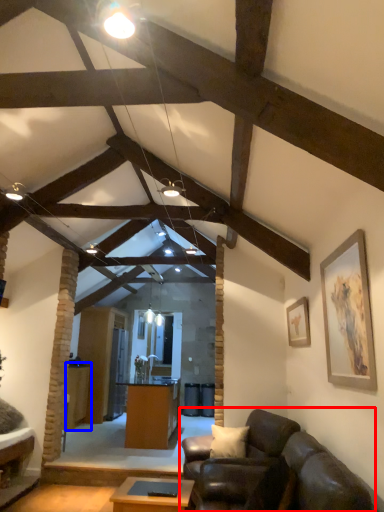
Question: Which object appears closest to the camera in this image, studio couch (highlighted by a red box) or table (highlighted by a blue box)?

Choices:
 (A) studio couch
 (B) table

Answer: (A)